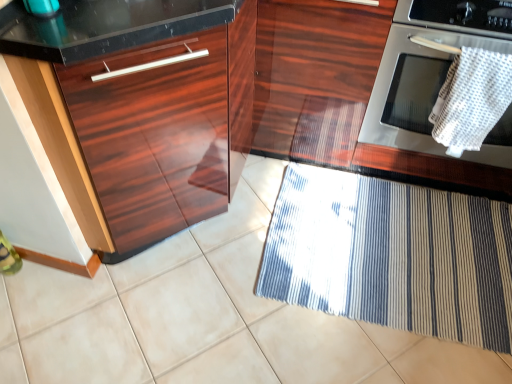
At what (x,y) coordinates should I click in order to perform the action: click on vacant area that is situated to the right of brushed metal kettle at upper left. Please return your answer as a coordinate pair (x, y). The height and width of the screenshot is (384, 512). Looking at the image, I should click on [x=108, y=20].